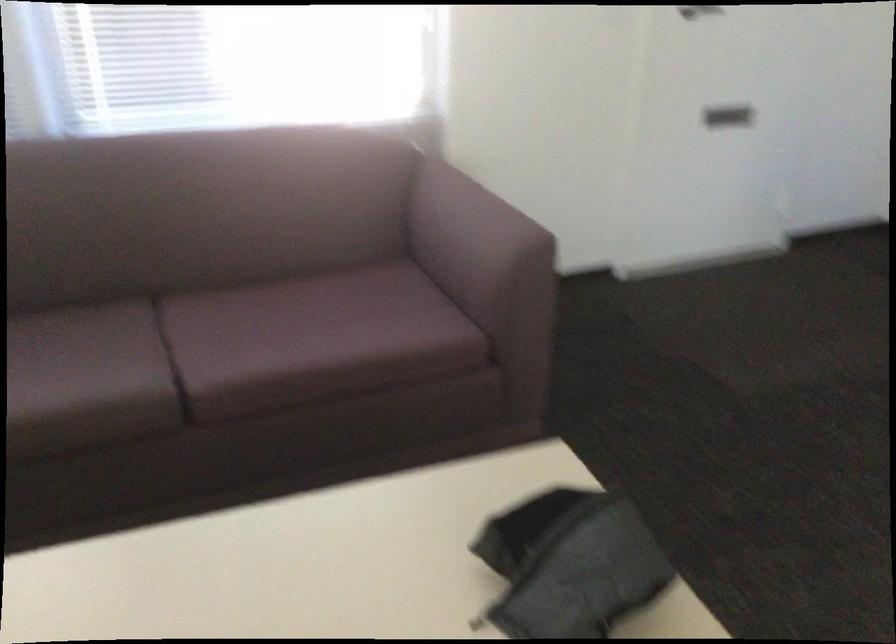
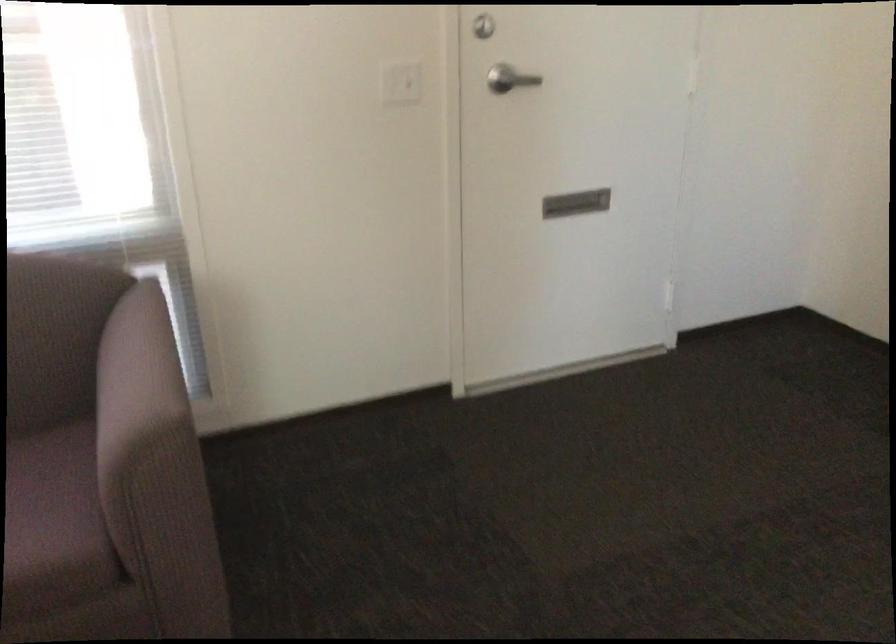
Locate, in the second image, the point that corresponds to [501,214] in the first image.

(136, 381)